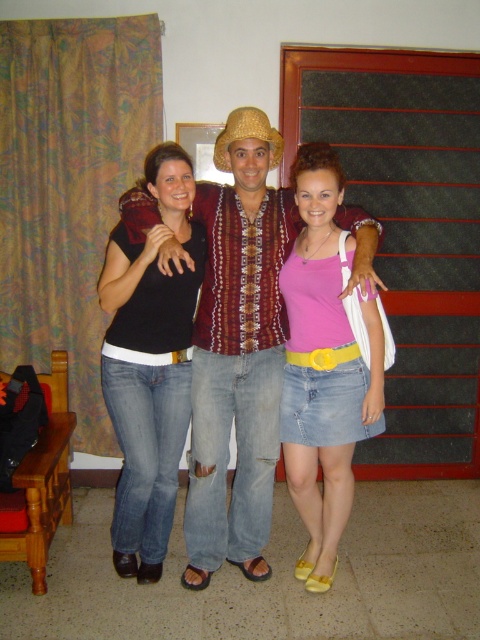
You are trying to decide which item of clothing would be easier to fold neatly. Based on the image, which one is wider, the patterned fabric shirt at center or the pink denim skirt at center?

The patterned fabric shirt at center is wider than the pink denim skirt at center according to the description, so it might be harder to fold neatly due to its width.

You are trying to decide if the patterned fabric shirt at center can cover the golden straw cowboy hat at center completely when folded over. Based on their sizes, is this possible?

The patterned fabric shirt at center is wider than golden straw cowboy hat at center, so yes, it can cover it completely when folded over.